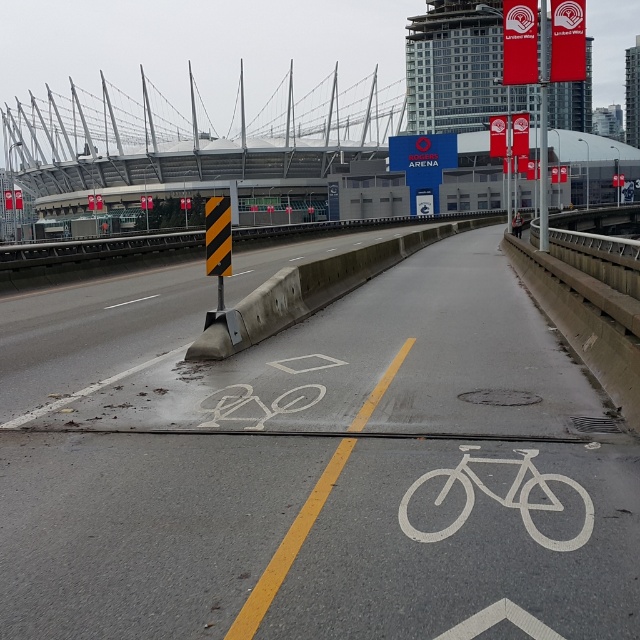
Question: Does white painted bicycle at center have a greater width compared to yellow/black striped sign at center?

Choices:
 (A) no
 (B) yes

Answer: (A)

Question: Estimate the real-world distances between objects in this image. Which object is farther from the white painted bicycle at center?

Choices:
 (A) white painted bicycle lane at center
 (B) yellow/black striped sign at center
 (C) concrete bridge at upper center

Answer: (C)

Question: Which point is closer to the camera?

Choices:
 (A) (202, 614)
 (B) (262, 157)

Answer: (A)

Question: Is concrete bridge at upper center above white painted bicycle at center?

Choices:
 (A) yes
 (B) no

Answer: (A)

Question: From the image, what is the correct spatial relationship of white painted bicycle at center in relation to metallic silver bicycle at center?

Choices:
 (A) above
 (B) below

Answer: (B)

Question: Among these points, which one is nearest to the camera?

Choices:
 (A) (480, 497)
 (B) (515, 234)
 (C) (68, 593)

Answer: (C)